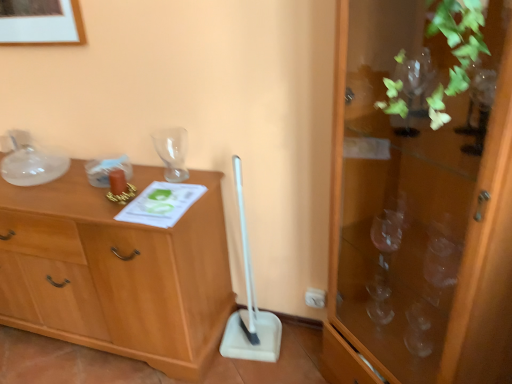
Question: From their relative heights in the image, would you say transparent glass vase at upper center is taller or shorter than wooden chest of drawers at left?

Choices:
 (A) short
 (B) tall

Answer: (A)

Question: Looking at their shapes, would you say transparent glass vase at upper center is wider or thinner than wooden chest of drawers at left?

Choices:
 (A) wide
 (B) thin

Answer: (B)

Question: Estimate the real-world distances between objects in this image. Which object is closer to the wooden chest of drawers at left?

Choices:
 (A) white plastic shovel at center
 (B) transparent glass cabinet at right
 (C) transparent glass vase at upper center

Answer: (A)

Question: Which object is positioned closest to the transparent glass cabinet at right?

Choices:
 (A) transparent glass vase at upper center
 (B) white plastic shovel at center
 (C) wooden chest of drawers at left

Answer: (B)